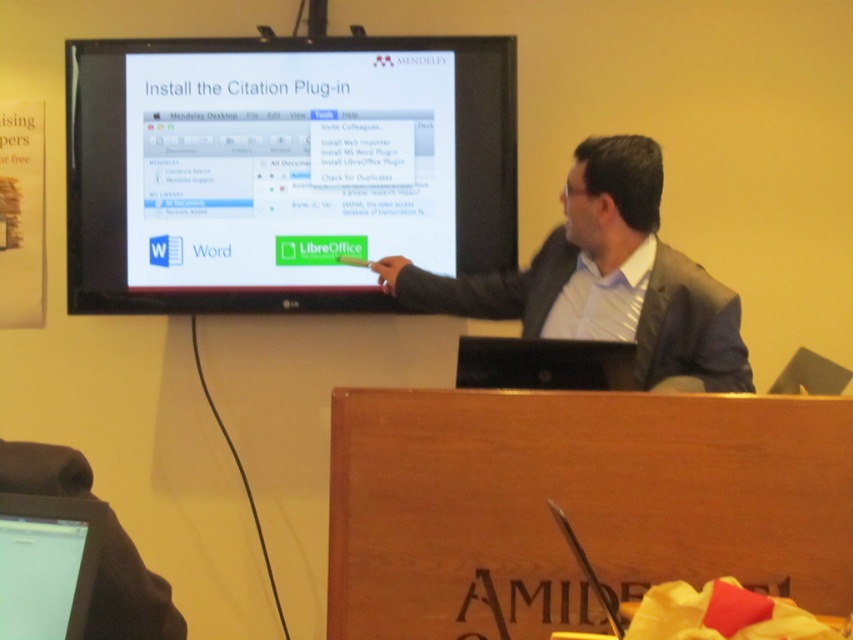
Question: Which point is farther to the camera?

Choices:
 (A) wooden at center
 (B) matte black monitor at upper center

Answer: (B)

Question: Among these objects, which one is farthest from the camera?

Choices:
 (A) wooden at center
 (B) white glossy screen at lower left

Answer: (A)

Question: Does matte black monitor at upper center have a greater width compared to wooden at center?

Choices:
 (A) no
 (B) yes

Answer: (B)

Question: Can you confirm if gray suit at center is positioned to the left of white glossy screen at lower left?

Choices:
 (A) no
 (B) yes

Answer: (A)

Question: Considering the relative positions of matte black monitor at upper center and wooden at center in the image provided, where is matte black monitor at upper center located with respect to wooden at center?

Choices:
 (A) right
 (B) left

Answer: (B)

Question: Based on their relative distances, which object is nearer to the white glossy screen at lower left?

Choices:
 (A) black plastic laptop at center
 (B) gray suit at center
 (C) matte black monitor at upper center
 (D) wooden at center

Answer: (D)